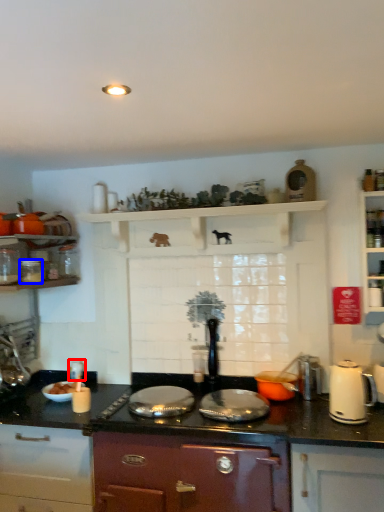
Question: Which object appears farthest to the camera in this image, appliance (highlighted by a red box) or kitchen appliance (highlighted by a blue box)?

Choices:
 (A) appliance
 (B) kitchen appliance

Answer: (A)